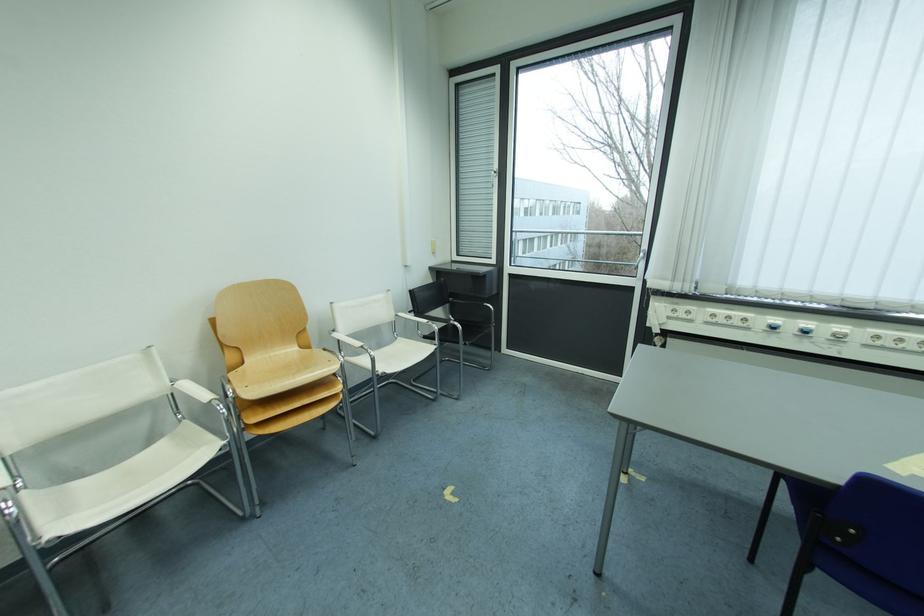
Find the location of a particular element. The height and width of the screenshot is (616, 924). blind control chain is located at coordinates (791, 329).